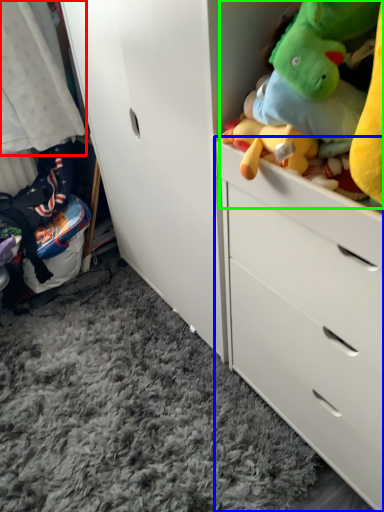
Question: Which is nearer to the baby clothe (highlighted by a red box)? chest of drawers (highlighted by a blue box) or stuff (highlighted by a green box).

Choices:
 (A) chest of drawers
 (B) stuff

Answer: (A)